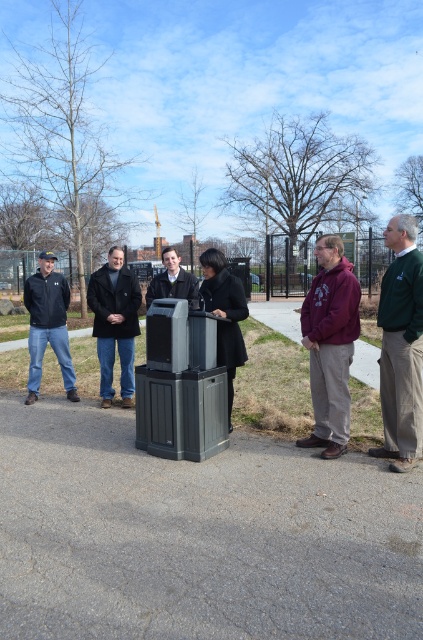
You are a photographer trying to capture a photo of the dark blue wool coat at center and the matte black jacket at left. Which of the two should you focus on if you want to include both in the frame without cropping either?

A: The dark blue wool coat at center is much taller than the matte black jacket at left, so you should focus on the dark blue wool coat at center to ensure both fit in the frame without cropping.

You are a photographer trying to capture a candid shot of the matte black jacket at left and the dark gray plastic trash can at center. Based on their heights, which object should you focus on first to ensure both are in frame without needing to adjust your camera angle?

The matte black jacket at left is shorter than the dark gray plastic trash can at center, so you should focus on the dark gray plastic trash can at center first to ensure both are in frame.

You are a photographer trying to capture a group photo of the dark blue wool coat at center and the matte black jacket at left. Since you want both subjects to appear equally sized in the photo, which subject should you move closer to the camera?

You should move closer to the dark blue wool coat at center because it might be wider than the matte black jacket at left, so moving closer to it would help balance their sizes in the photo.